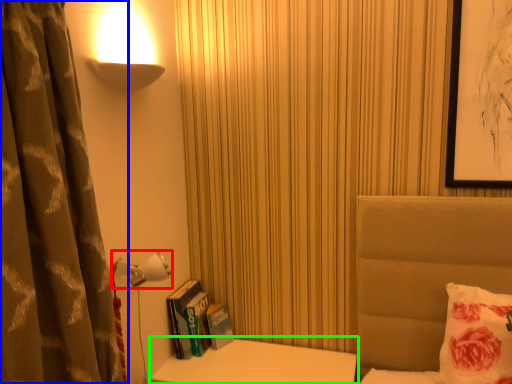
Question: Which is farther away from lamp (highlighted by a red box)? curtain (highlighted by a blue box) or table (highlighted by a green box)?

Choices:
 (A) curtain
 (B) table

Answer: (B)